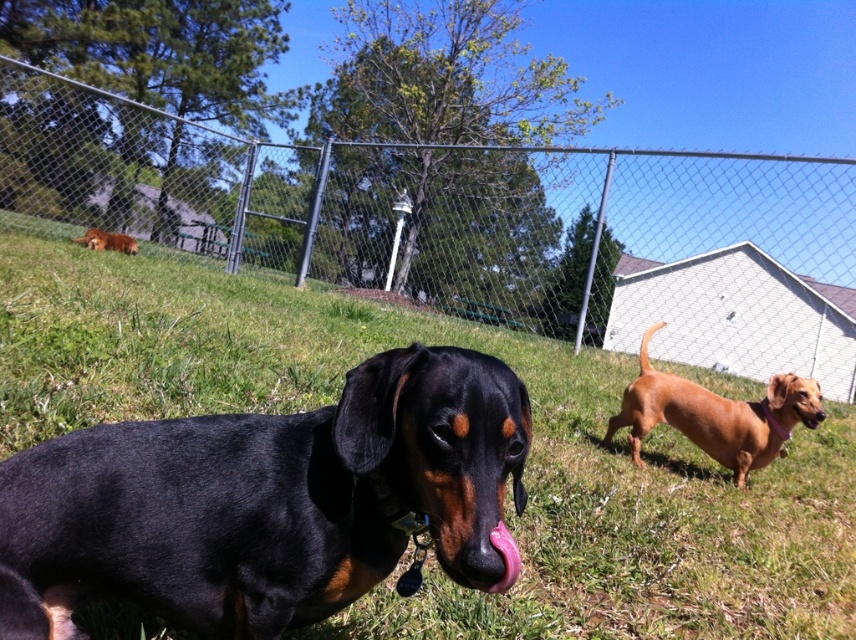
Question: Which point is closer to the camera?

Choices:
 (A) (506, 540)
 (B) (263, 429)

Answer: (A)

Question: Does smooth brown dog at right appear on the right side of pink rubber tongue at center?

Choices:
 (A) yes
 (B) no

Answer: (A)

Question: Does black shiny coat at center have a smaller size compared to brown fur dog at upper left?

Choices:
 (A) no
 (B) yes

Answer: (B)

Question: Estimate the real-world distances between objects in this image. Which object is farther from the black shiny coat at center?

Choices:
 (A) pink rubber tongue at center
 (B) green grass at center

Answer: (B)

Question: Can you confirm if green grass at center is bigger than black shiny coat at center?

Choices:
 (A) no
 (B) yes

Answer: (A)

Question: Estimate the real-world distances between objects in this image. Which object is farther from the green grass at center?

Choices:
 (A) smooth brown dog at right
 (B) black shiny coat at center

Answer: (A)